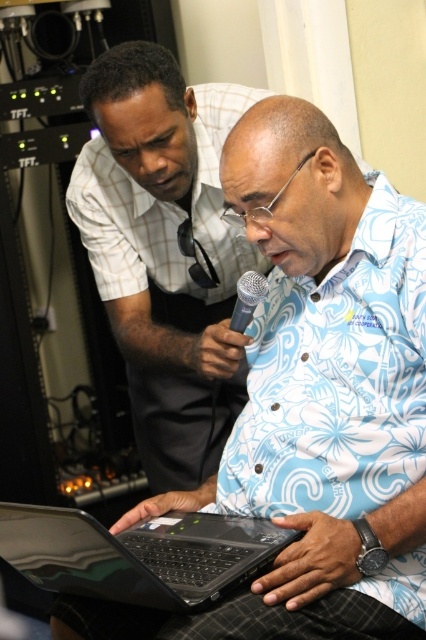
You are a photographer setting up equipment for a presentation. You have two items to position properly on the table. The black matte laptop at center and the black matte microphone at center. According to the scene, which item is located to the left of the other?

The black matte laptop at center is positioned on the left side of black matte microphone at center, so the laptop is to the left of the microphone.

You are standing at point (83, 580) and want to move to point (169, 138). Is the path directly in front of you clear?

Point (169, 138) is behind point (83, 580), so moving from point (83, 580) to point (169, 138) would require you to move backward. Since you are at point (83, 580), the path directly in front of you leads away from point (169, 138), so it is not clear for moving forward. However, if you turn around, the path behind you towards point (169, 138) may be clear.

You are a photographer positioned in front of the two people in the image. You want to take a photo that clearly shows both the blue floral shirt at center and the black matte laptop at center. Which object should you focus on first to ensure both are in focus?

The blue floral shirt at center is further to the viewer than the black matte laptop at center. To ensure both are in focus, you should focus on the blue floral shirt at center first, as it is closer to you, and the depth of field will extend to the laptop behind it.